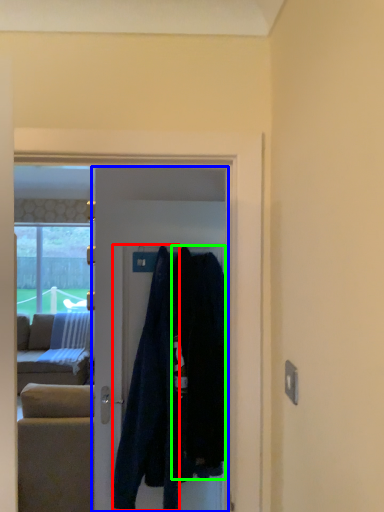
Question: Which object is the farthest from clothing (highlighted by a red box)? Choose among these: door (highlighted by a blue box) or clothing (highlighted by a green box).

Choices:
 (A) door
 (B) clothing

Answer: (A)